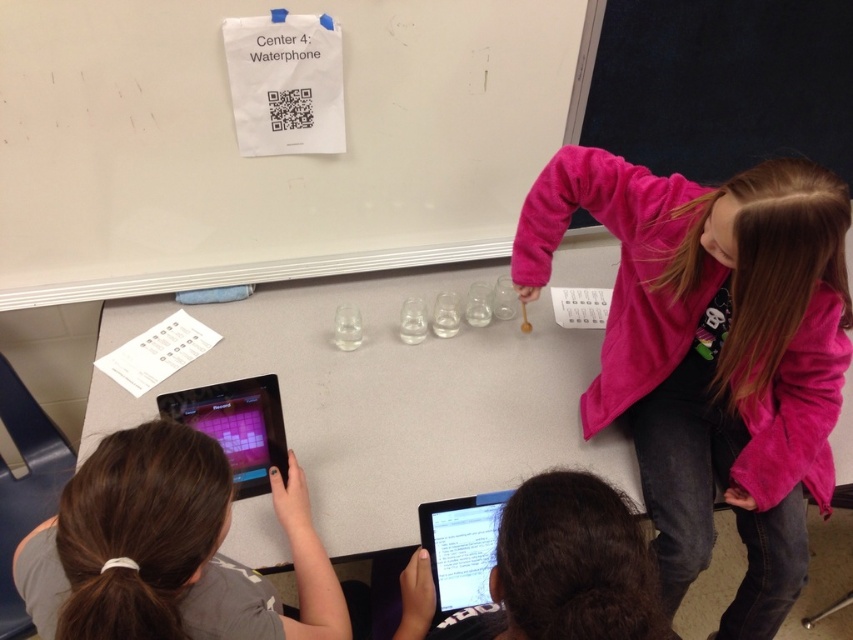
You are standing in front of the classroom scene and want to place a 3.5 feet long banner on the table. Can the banner fit on the gray matte table at center?

The gray matte table at center is 4.01 feet from viewer, but the banner length is not related to the distance. The banner length is 3.5 feet, but the table dimensions are not provided. Therefore, it is impossible to determine if the banner will fit based on the given information.

You are a teacher in the classroom and want to ensure that the gray fabric shirt at lower left and the black glossy tablet at lower left are visible to the camera mounted above the whiteboard. Based on their heights, which object is more likely to block the view of the other?

The gray fabric shirt at lower left is much taller than the black glossy tablet at lower left, so the gray fabric shirt at lower left is more likely to block the view of the black glossy tablet at lower left.